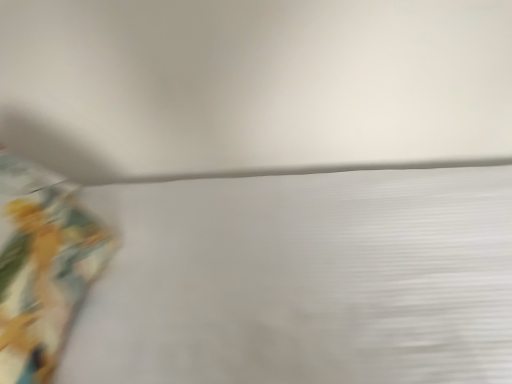
Question: Can you confirm if white textured sheet at lower left is positioned to the right of matte yellow curtain at left?

Choices:
 (A) yes
 (B) no

Answer: (A)

Question: Does white textured sheet at lower left come in front of matte yellow curtain at left?

Choices:
 (A) no
 (B) yes

Answer: (B)

Question: Considering the relative sizes of white textured sheet at lower left and matte yellow curtain at left in the image provided, is white textured sheet at lower left shorter than matte yellow curtain at left?

Choices:
 (A) no
 (B) yes

Answer: (A)

Question: Is white textured sheet at lower left with matte yellow curtain at left?

Choices:
 (A) yes
 (B) no

Answer: (B)

Question: Can you confirm if white textured sheet at lower left is thinner than matte yellow curtain at left?

Choices:
 (A) no
 (B) yes

Answer: (A)

Question: Is white textured sheet at lower left located outside matte yellow curtain at left?

Choices:
 (A) yes
 (B) no

Answer: (A)

Question: Considering the relative positions of matte yellow curtain at left and white textured sheet at lower left in the image provided, is matte yellow curtain at left to the right of white textured sheet at lower left from the viewer's perspective?

Choices:
 (A) yes
 (B) no

Answer: (B)

Question: Is matte yellow curtain at left smaller than white textured sheet at lower left?

Choices:
 (A) yes
 (B) no

Answer: (A)

Question: Is white textured sheet at lower left surrounded by matte yellow curtain at left?

Choices:
 (A) yes
 (B) no

Answer: (B)

Question: From the image's perspective, is matte yellow curtain at left under white textured sheet at lower left?

Choices:
 (A) yes
 (B) no

Answer: (A)

Question: Is matte yellow curtain at left behind white textured sheet at lower left?

Choices:
 (A) no
 (B) yes

Answer: (B)

Question: From a real-world perspective, is matte yellow curtain at left positioned over white textured sheet at lower left based on gravity?

Choices:
 (A) yes
 (B) no

Answer: (B)

Question: From a real-world perspective, is matte yellow curtain at left above or below white textured sheet at lower left?

Choices:
 (A) below
 (B) above

Answer: (A)